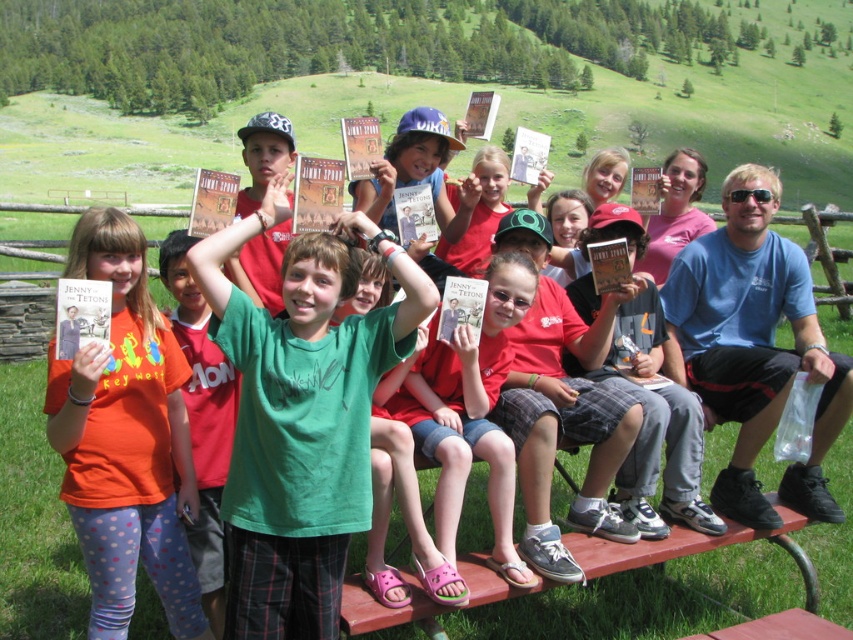
Does matte orange t-shirt at center lie behind pink fabric shorts at center?

No, it is not.

Does point (190, 518) lie in front of point (439, 490)?

No, it is not.

At what (x,y) coordinates should I click in order to perform the action: click on matte orange t-shirt at center. Please return your answer as a coordinate pair (x, y). The image size is (853, 640). Looking at the image, I should click on (126, 440).

Is green cotton shirt at center positioned in front of matte orange t-shirt at center?

That is False.

Where is `green cotton shirt at center`? green cotton shirt at center is located at coordinates (300, 417).

Image resolution: width=853 pixels, height=640 pixels. What are the coordinates of `green cotton shirt at center` in the screenshot? It's located at (300, 417).

Can you confirm if green cotton shirt at center is smaller than pink fabric shorts at center?

Incorrect, green cotton shirt at center is not smaller in size than pink fabric shorts at center.

I want to click on green cotton shirt at center, so click(300, 417).

At what (x,y) coordinates should I click in order to perform the action: click on green cotton shirt at center. Please return your answer as a coordinate pair (x, y). Looking at the image, I should click on (300, 417).